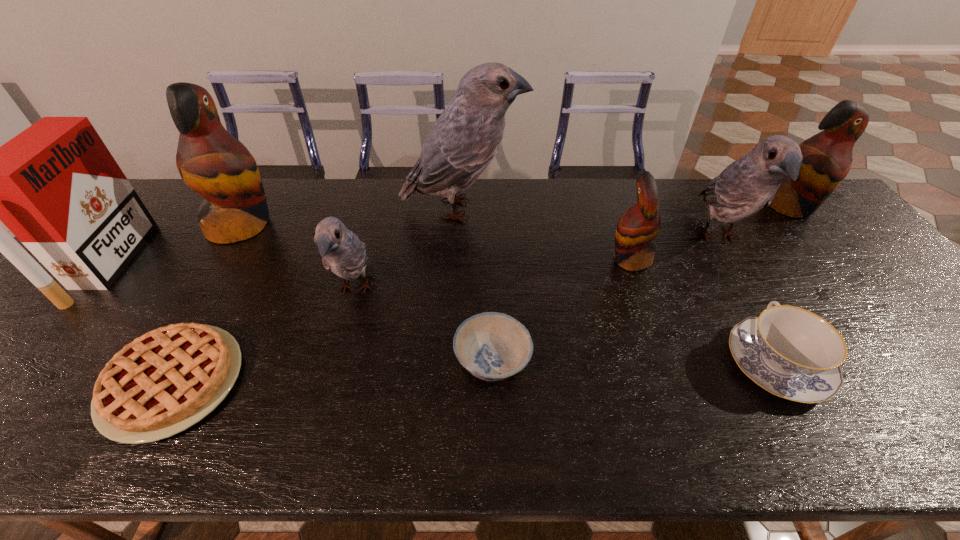
Find the location of `free space that satisfies the following two spatial constraints: 1. on the front-facing side of the cigarette case; 2. on the right side of the pie`. free space that satisfies the following two spatial constraints: 1. on the front-facing side of the cigarette case; 2. on the right side of the pie is located at coordinates (11, 382).

At what (x,y) coordinates should I click in order to perform the action: click on vacant space that satisfies the following two spatial constraints: 1. on the front-facing side of the cigarette case; 2. with the handle on the side of the chinaware. Please return your answer as a coordinate pair (x, y). Image resolution: width=960 pixels, height=540 pixels. Looking at the image, I should click on (26, 363).

Where is `vacant space that satisfies the following two spatial constraints: 1. on the face of the biggest red parrot; 2. on the left side of the shortest object`? The width and height of the screenshot is (960, 540). vacant space that satisfies the following two spatial constraints: 1. on the face of the biggest red parrot; 2. on the left side of the shortest object is located at coordinates (151, 382).

At what (x,y) coordinates should I click in order to perform the action: click on blank area in the image that satisfies the following two spatial constraints: 1. on the back side of the pie; 2. on the face of the leftmost red parrot. Please return your answer as a coordinate pair (x, y). Looking at the image, I should click on (258, 226).

You are a GUI agent. You are given a task and a screenshot of the screen. Output one action in this format:
    pyautogui.click(x=<x>, y=<y>)
    Task: Click on the vacant area that satisfies the following two spatial constraints: 1. on the face of the rightmost object; 2. on the face of the biggest red parrot
    Image resolution: width=960 pixels, height=540 pixels.
    Given the screenshot: What is the action you would take?
    pyautogui.click(x=805, y=226)